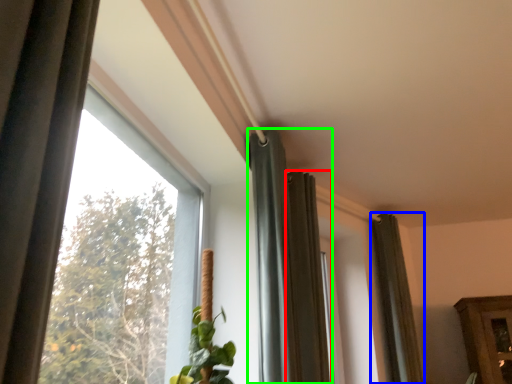
Question: Which object is positioned farthest from curtain (highlighted by a red box)? Select from curtain (highlighted by a blue box) and curtain (highlighted by a green box).

Choices:
 (A) curtain
 (B) curtain

Answer: (A)